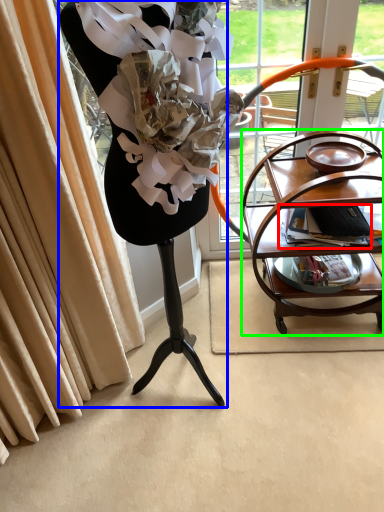
Question: Which object is positioned farthest from magazine (highlighted by a red box)? Select from furniture (highlighted by a blue box) and table (highlighted by a green box).

Choices:
 (A) furniture
 (B) table

Answer: (A)